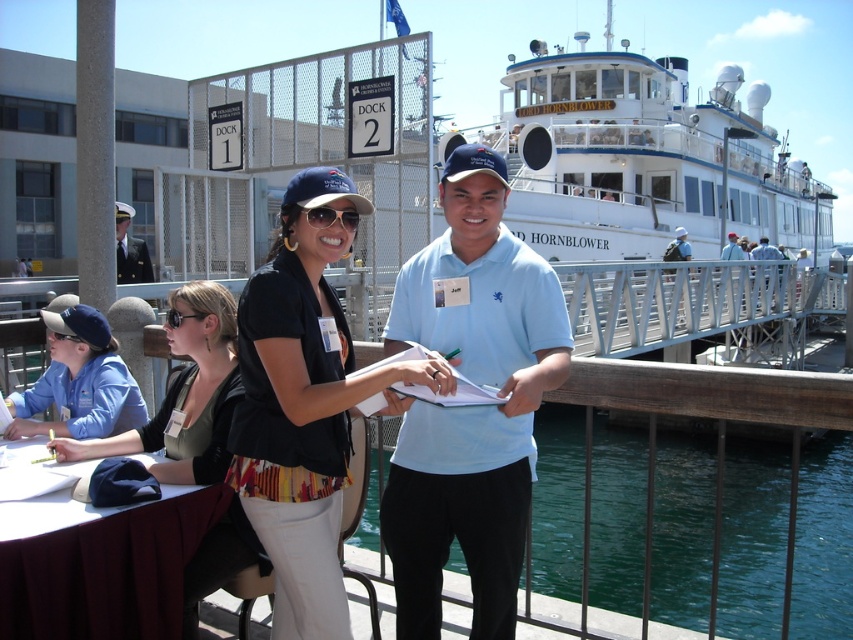
Can you confirm if maroon fabric table at lower left is positioned to the left of light blue shirt at right?

Yes, maroon fabric table at lower left is to the left of light blue shirt at right.

Between maroon fabric table at lower left and light blue shirt at right, which one is positioned higher?

light blue shirt at right is above.

Does point (170, 544) lie in front of point (735, 256)?

Yes, it is.

This screenshot has height=640, width=853. In order to click on maroon fabric table at lower left in this screenshot , I will do `click(100, 563)`.

Measure the distance from black matte shirt at center to matte black shirt at center.

black matte shirt at center is 32.06 inches from matte black shirt at center.

Is black matte shirt at center to the right of matte black shirt at center from the viewer's perspective?

Correct, you'll find black matte shirt at center to the right of matte black shirt at center.

At what (x,y) coordinates should I click in order to perform the action: click on black matte shirt at center. Please return your answer as a coordinate pair (x, y). This screenshot has height=640, width=853. Looking at the image, I should click on (305, 406).

Between light blue polo shirt at center and light blue shirt at right, which one has less height?

Standing shorter between the two is light blue shirt at right.

From the picture: Can you confirm if light blue polo shirt at center is positioned below light blue shirt at right?

Indeed, light blue polo shirt at center is positioned under light blue shirt at right.

Who is more distant from viewer, [401,312] or [734,236]?

The point [734,236] is more distant.

Image resolution: width=853 pixels, height=640 pixels. I want to click on light blue polo shirt at center, so click(x=469, y=408).